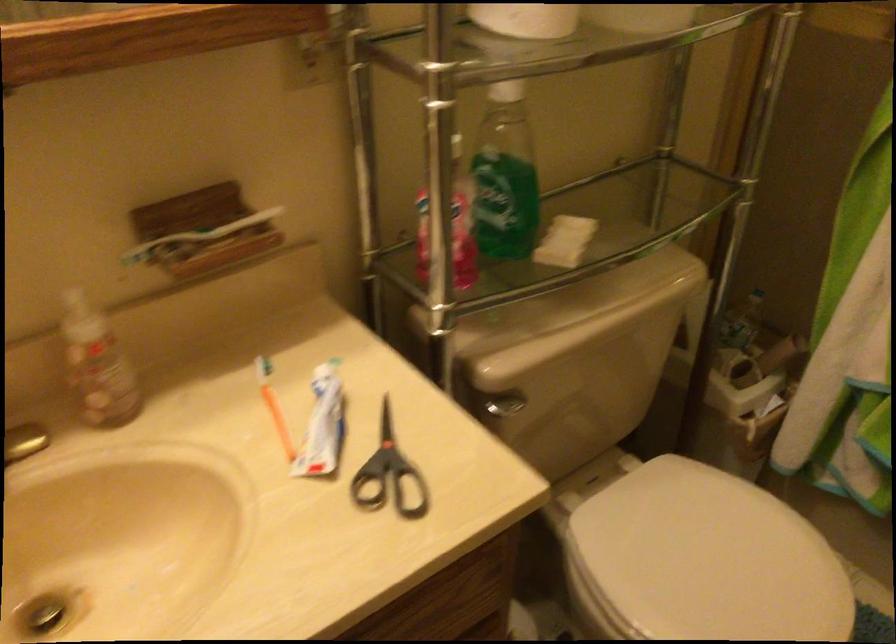
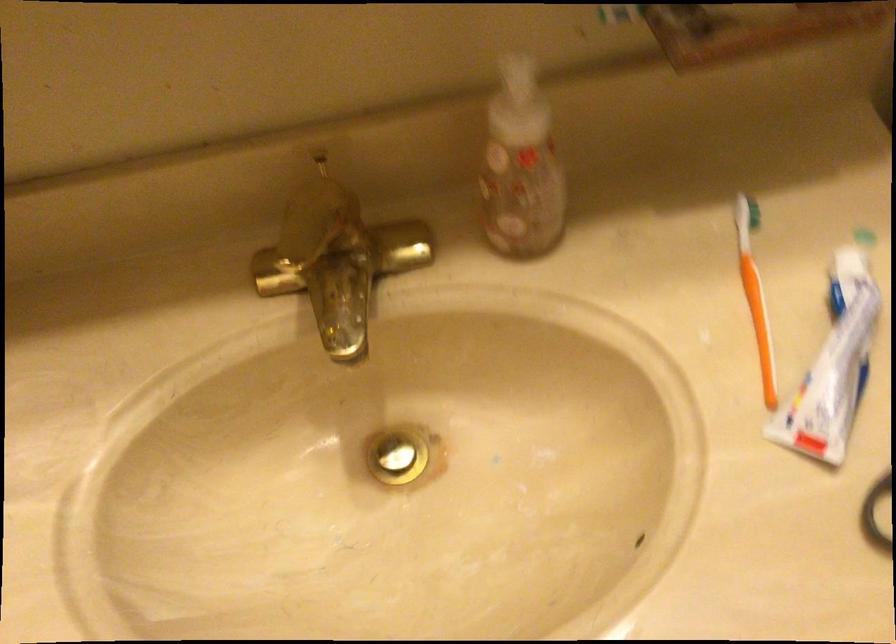
Question: I am providing you with two images of the same scene from different viewpoints. Which of the following objects are not visible in image2?

Choices:
 (A) soap dispenser pump
 (B) orange toothbrush
 (C) sink drain stopper
 (D) none of these

Answer: (D)